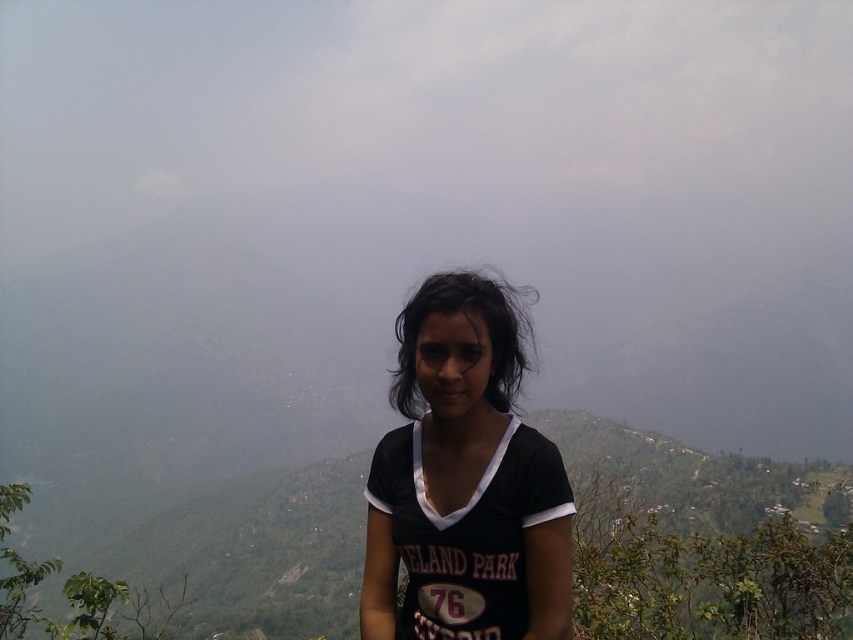
You are a photographer setting up a shot of the person in the scene. You need to ensure that the black matte shirt at center and the black matte hair at center are both visible in the frame. Based on their positions, which object should you focus on first to ensure both are in focus?

The black matte hair at center is located above the black matte shirt at center. To ensure both are in focus, you should focus on the black matte hair at center first since it is closer to the camera.

You are a photographer trying to capture the scenic mountain backdrop. You notice a point at coordinates (465, 481) in your viewfinder. What object is located at this point?

The point at coordinates (465, 481) corresponds to the black matte shirt at center.

You are a photographer setting up a tripod 50 feet away from the black matte shirt at center in a misty mountain scene. Can you capture the entire shirt in your shot without moving the tripod?

The black matte shirt at center is 51.63 feet away from the camera. Since the tripod is set at 50 feet, the shirt is slightly farther than the tripod distance, so you might need to adjust your lens or move closer to ensure the entire shirt fits in the frame.